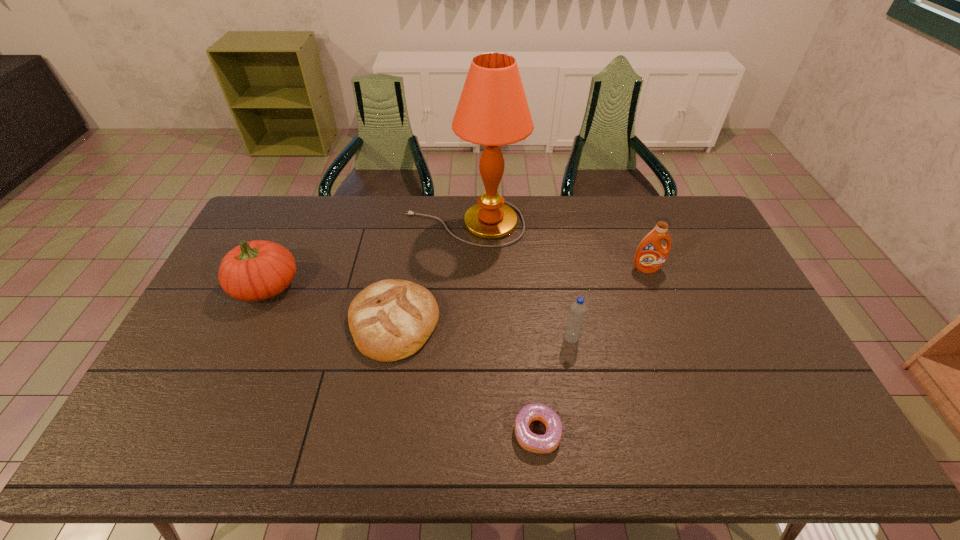
Find the location of a particular element. free space between the tallest object and the doughnut is located at coordinates (501, 328).

You are a GUI agent. You are given a task and a screenshot of the screen. Output one action in this format:
    pyautogui.click(x=<x>, y=<y>)
    Task: Click on the unoccupied area between the pumpkin and the bread
    The height and width of the screenshot is (540, 960).
    Given the screenshot: What is the action you would take?
    pyautogui.click(x=329, y=304)

You are a GUI agent. You are given a task and a screenshot of the screen. Output one action in this format:
    pyautogui.click(x=<x>, y=<y>)
    Task: Click on the closest object to the bread
    
    Given the screenshot: What is the action you would take?
    pyautogui.click(x=493, y=111)

Identify the location of object that is the second nearest to the leftmost object. This screenshot has width=960, height=540. (493, 111).

The width and height of the screenshot is (960, 540). In order to click on vacant space that satisfies the following two spatial constraints: 1. on the front side of the farthest object; 2. on the left side of the fifth object from left to right in this screenshot , I will do `click(460, 338)`.

At what (x,y) coordinates should I click in order to perform the action: click on blank space that satisfies the following two spatial constraints: 1. on the back side of the pumpkin; 2. on the right side of the tallest object. Please return your answer as a coordinate pair (x, y). Looking at the image, I should click on (294, 224).

Image resolution: width=960 pixels, height=540 pixels. Identify the location of free space that satisfies the following two spatial constraints: 1. on the front side of the second object from right to left; 2. on the left side of the pumpkin. (242, 338).

The image size is (960, 540). Identify the location of free space that satisfies the following two spatial constraints: 1. on the front side of the nearest object; 2. on the right side of the lamp. (457, 433).